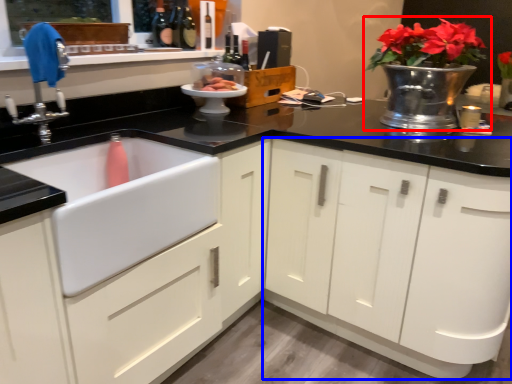
Question: Which point is closer to the camera, houseplant (highlighted by a red box) or cabinetry (highlighted by a blue box)?

Choices:
 (A) houseplant
 (B) cabinetry

Answer: (B)